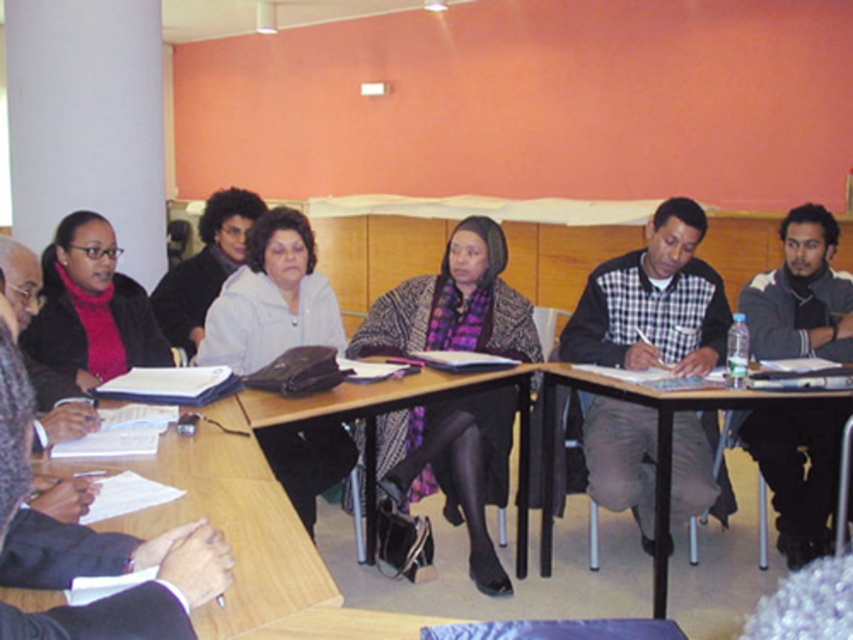
You are a photographer positioned at the back of the room. You want to take a photo of the knitted woolen shawl at center and the checkered fabric shirt at center such that both are in focus. Given that your camera has a depth of field that can sharply focus objects within a 15 inch range, will both items be in focus?

The knitted woolen shawl at center is 18.87 inches away from the checkered fabric shirt at center. Since the distance between them exceeds the camera sensor depth of field range of 15 inches, at least one of the items will be out of focus.

You are a photographer taking a photo of the meeting participants. You notice the knitted woolen shawl at center and the checkered fabric shirt at center. Which object is positioned lower in the image?

The knitted woolen shawl at center is located below the checkered fabric shirt at center, so it is positioned lower in the image.